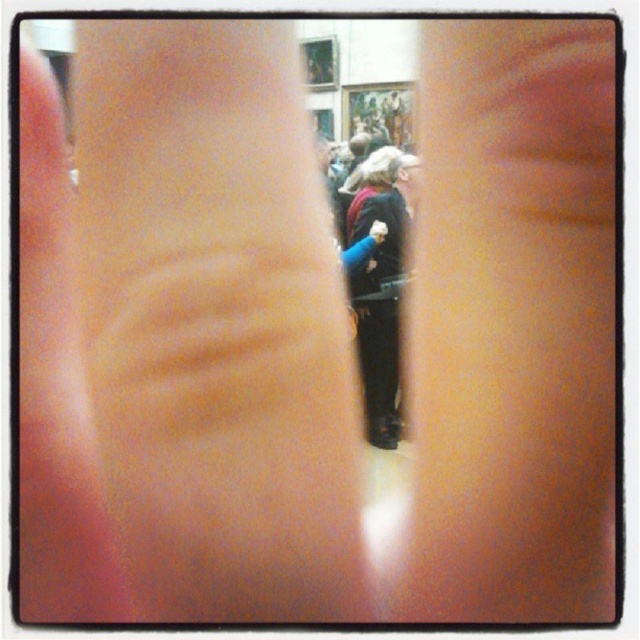
Question: From the image, what is the correct spatial relationship of pink matte skin at center in relation to velvet black coat at center?

Choices:
 (A) below
 (B) above

Answer: (A)

Question: Does pink smooth skin at center appear on the right side of pink matte skin at center?

Choices:
 (A) no
 (B) yes

Answer: (B)

Question: Which object is farther from the camera taking this photo?

Choices:
 (A) velvet black coat at center
 (B) smooth skin hand at center

Answer: (A)

Question: Which point is closer to the camera?

Choices:
 (A) (48, 561)
 (B) (433, 426)
 (C) (371, 355)
 (D) (125, 83)

Answer: (D)

Question: Which object is the closest to the velvet black coat at center?

Choices:
 (A) smooth skin hand at center
 (B) pink matte skin at center

Answer: (A)

Question: Can you confirm if pink smooth skin at center is positioned below pink matte skin at center?

Choices:
 (A) yes
 (B) no

Answer: (A)